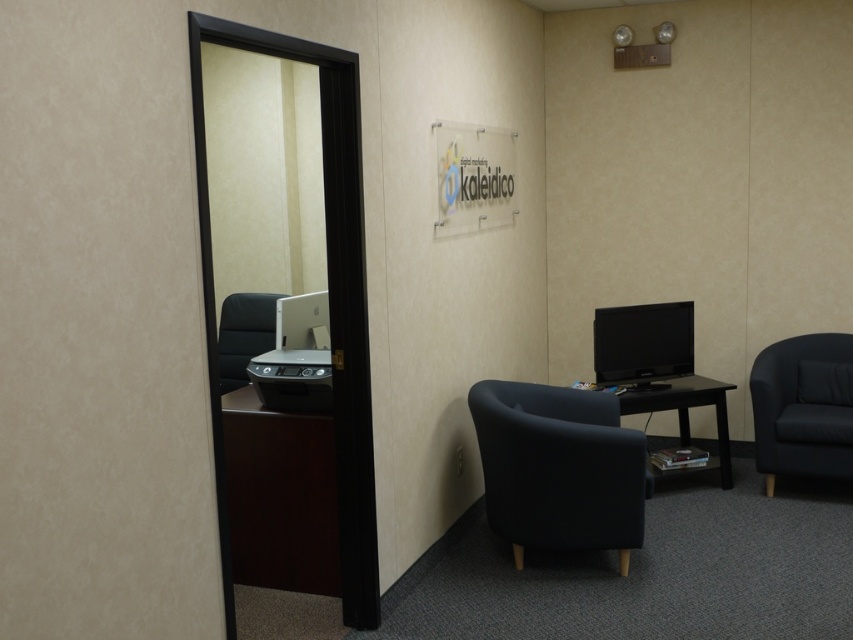
You are organizing a meeting in this office and need to fit a narrow 12 inch wide laptop between the black fabric swivel chair at right and the black wood table at center. Can the space between them accommodate the laptop?

The black fabric swivel chair at right is thinner than the black wood table at center, so there is sufficient space between them to fit a 12 inch wide laptop.

You are organizing a meeting in the office and need to move the black fabric swivel chair at right closer to the white glossy printer at center. Which direction should you push the chair to get it closer?

The black fabric swivel chair at right is to the right of the white glossy printer at center, so you should push it to the left to move it closer.